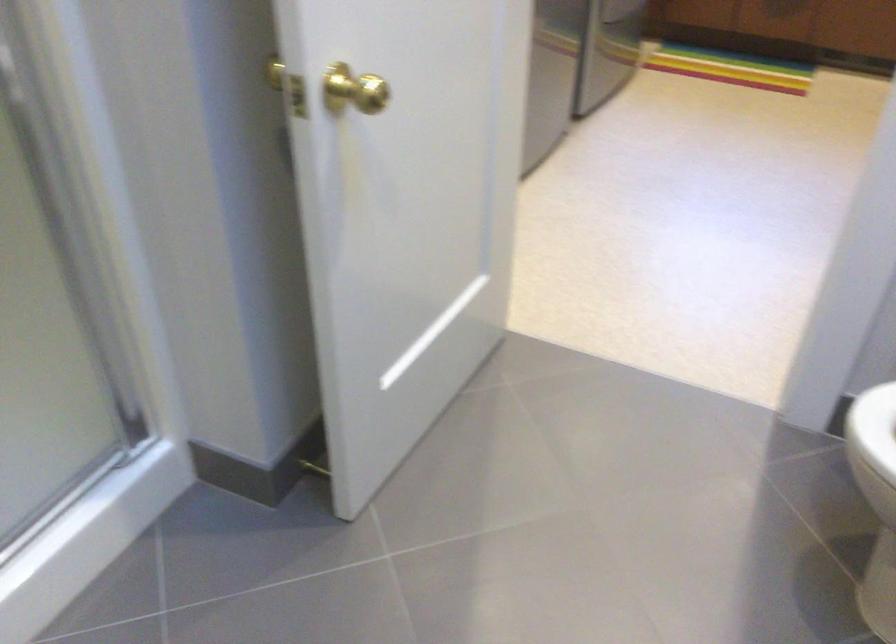
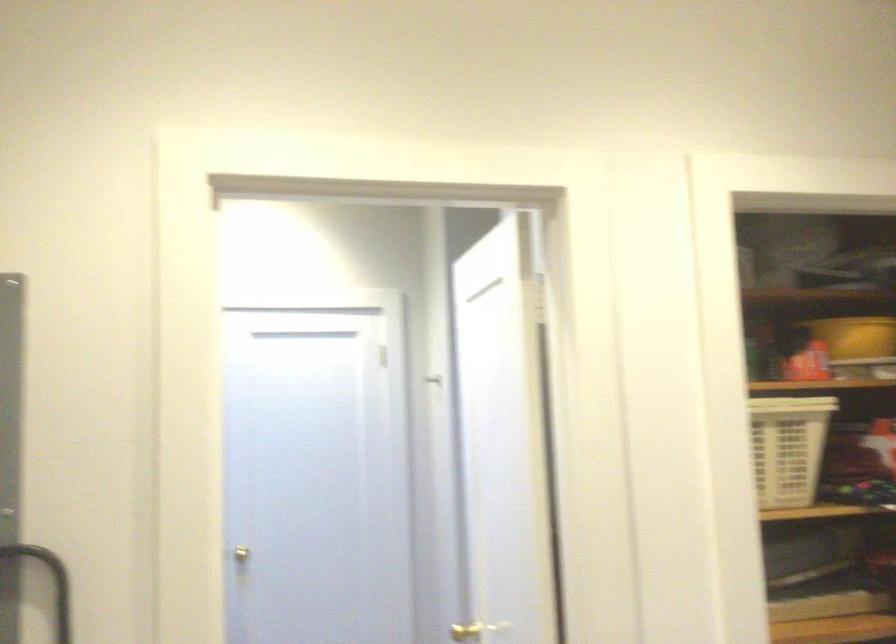
Where in the second image is the point corresponding to (298,104) from the first image?

(464, 632)